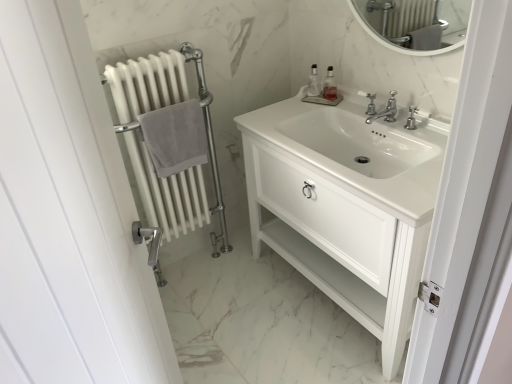
Question: Considering the positions of white matte radiator at left and white glossy sink at center in the image, is white matte radiator at left taller or shorter than white glossy sink at center?

Choices:
 (A) short
 (B) tall

Answer: (B)

Question: From the image's perspective, is white matte radiator at left positioned above or below white glossy sink at center?

Choices:
 (A) above
 (B) below

Answer: (B)

Question: Based on their relative distances, which object is farther from the white matte radiator at left?

Choices:
 (A) clear plastic soap dispenser at upper right, marked as the first soap dispenser in a left-to-right arrangement
 (B) translucent plastic soap dispenser at upper center, the 2th soap dispenser in the left-to-right sequence
 (C) white glossy sink at center
 (D) white glossy cabinet at center
 (E) gray cotton towel at left

Answer: (B)

Question: Considering the real-world distances, which object is closest to the white matte radiator at left?

Choices:
 (A) silver metallic faucet at center
 (B) white glossy cabinet at center
 (C) clear plastic soap dispenser at upper right, marked as the first soap dispenser in a left-to-right arrangement
 (D) white glossy sink at center
 (E) translucent plastic soap dispenser at upper center, the 2th soap dispenser in the left-to-right sequence

Answer: (D)